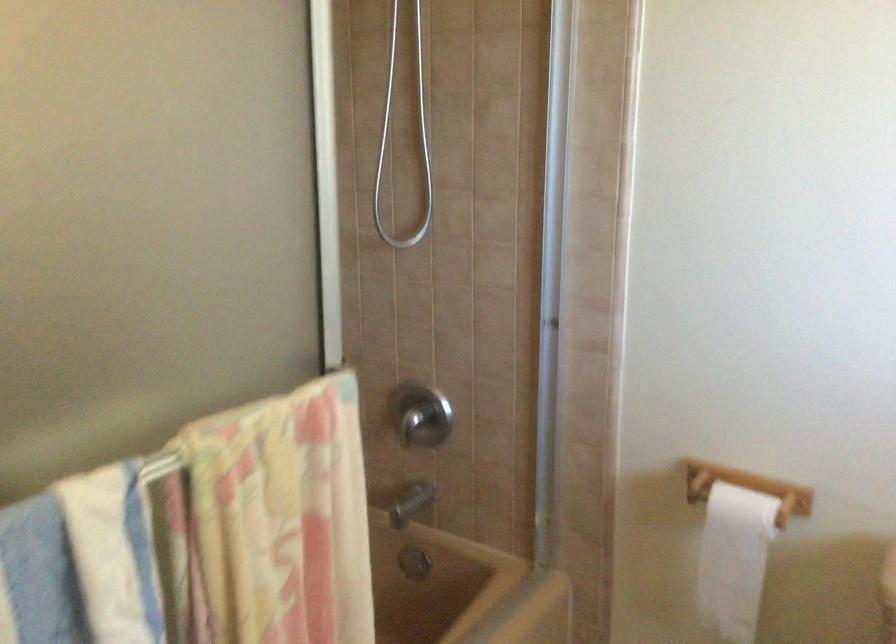
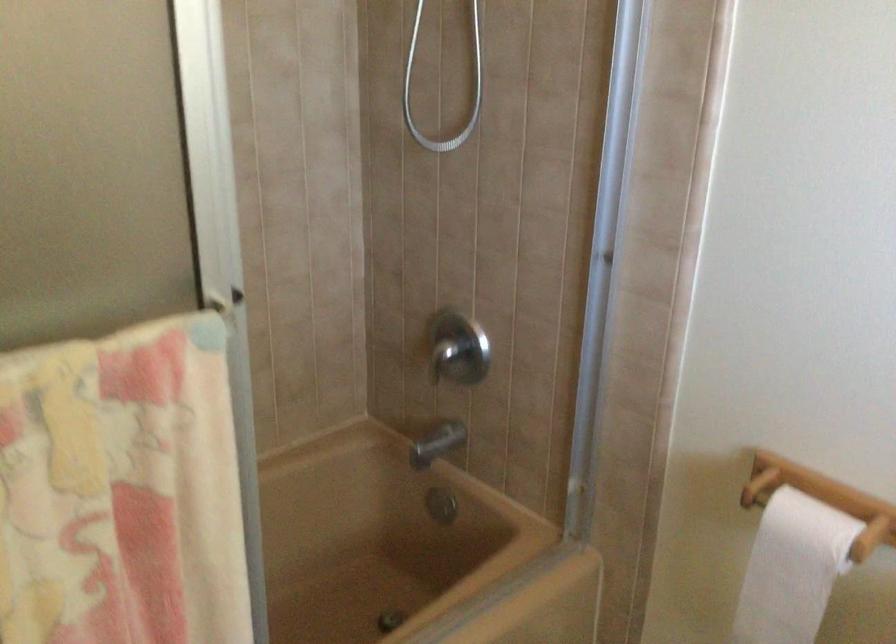
Where in the second image is the point corresponding to (x=426, y=418) from the first image?

(458, 348)